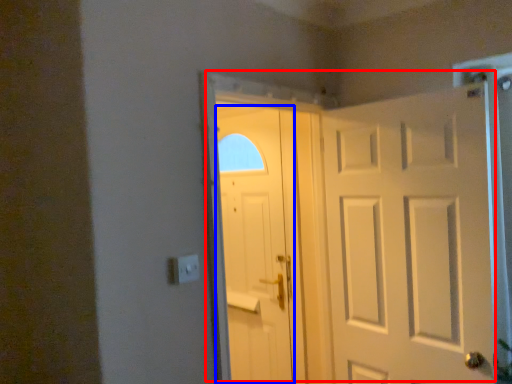
Question: Which object appears farthest to the camera in this image, door (highlighted by a red box) or door (highlighted by a blue box)?

Choices:
 (A) door
 (B) door

Answer: (B)